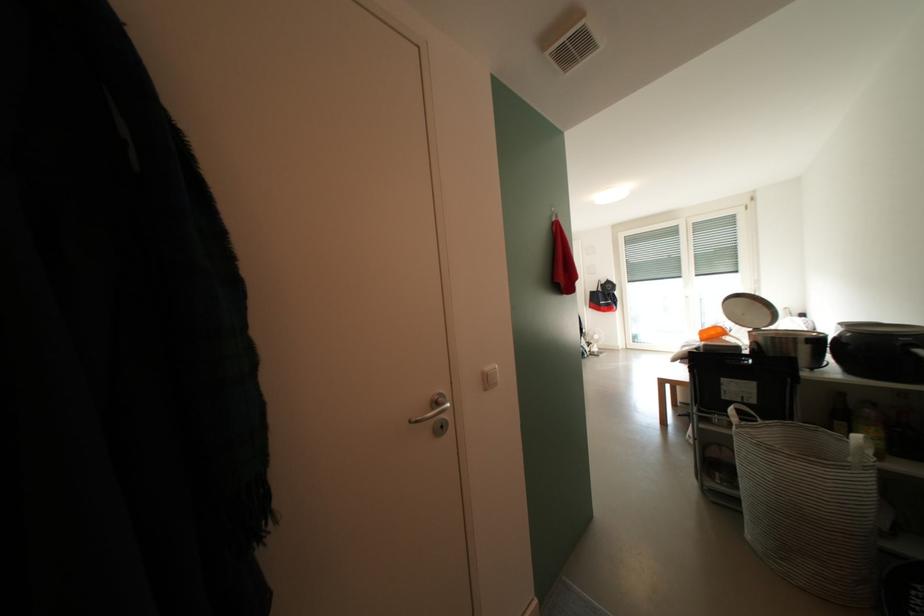
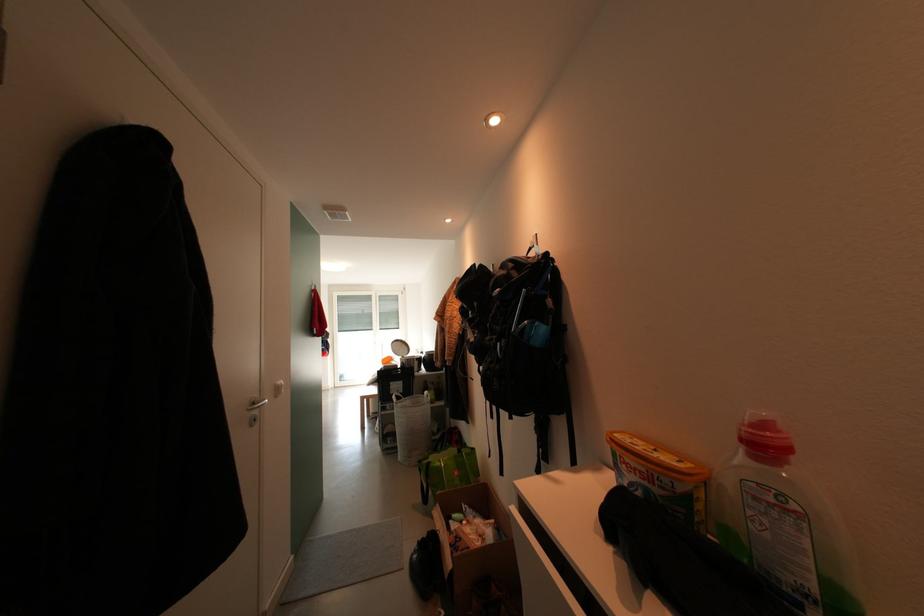
In the second image, find the point that corresponds to point 670,385 in the first image.

(371, 400)